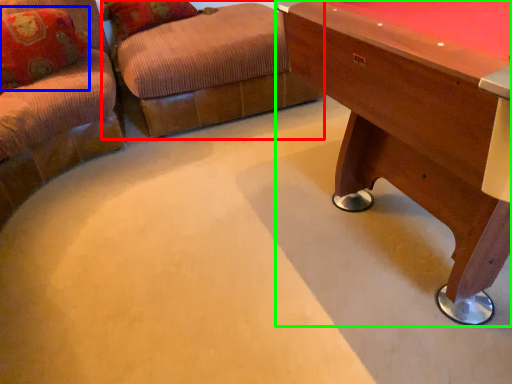
Question: Which object is the closest to the swivel chair (highlighted by a red box)? Choose among these: pillow (highlighted by a blue box) or table (highlighted by a green box).

Choices:
 (A) pillow
 (B) table

Answer: (A)